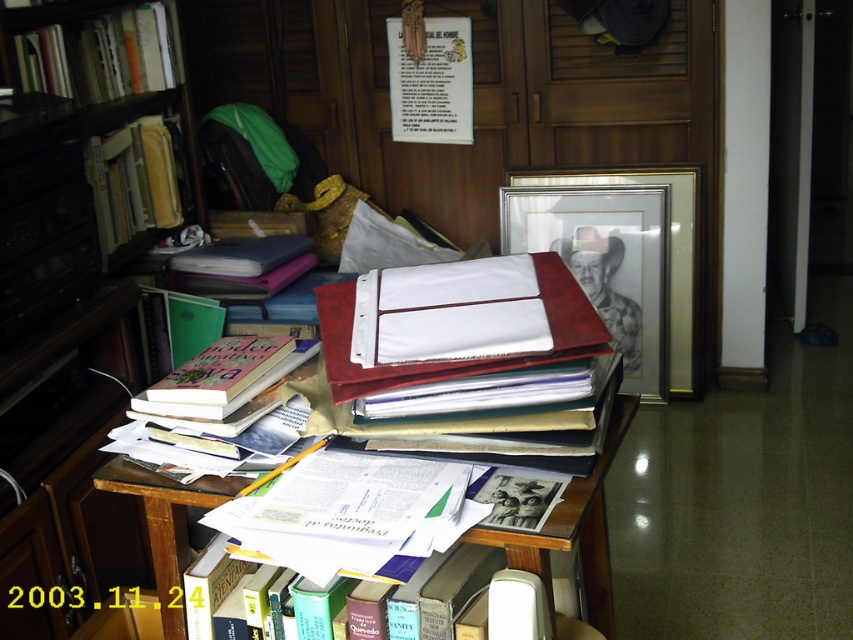
Question: Which object is positioned closest to the hardcover book at left?

Choices:
 (A) wooden bookshelf at left
 (B) hardcover book at upper left

Answer: (A)

Question: Based on their relative distances, which object is farther from the hardcover book at upper left?

Choices:
 (A) matte pink book at center
 (B) hardcover book at left
 (C) wooden bookshelf at left
 (D) wooden desk at center

Answer: (D)

Question: Estimate the real-world distances between objects in this image. Which object is closer to the wooden desk at center?

Choices:
 (A) hardcover book at left
 (B) wooden bookshelf at left

Answer: (B)

Question: Is wooden bookshelf at left positioned in front of hardcover book at upper left?

Choices:
 (A) no
 (B) yes

Answer: (B)

Question: Can you confirm if matte pink book at center is bigger than hardcover book at upper left?

Choices:
 (A) no
 (B) yes

Answer: (A)

Question: Can you confirm if matte pink book at center is wider than hardcover book at left?

Choices:
 (A) no
 (B) yes

Answer: (B)